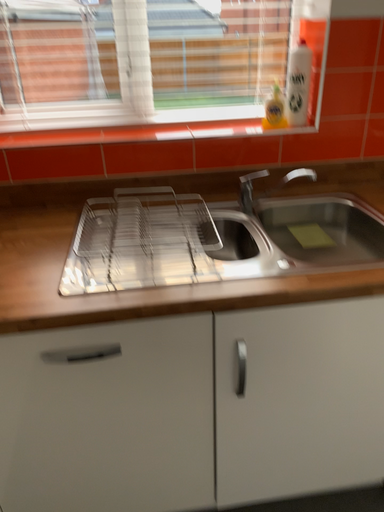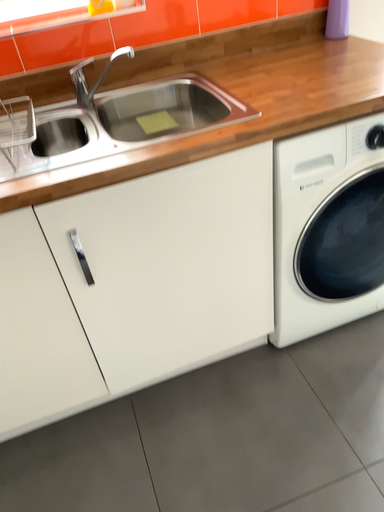
Question: Which way did the camera rotate in the video?

Choices:
 (A) rotated downward
 (B) rotated upward

Answer: (A)